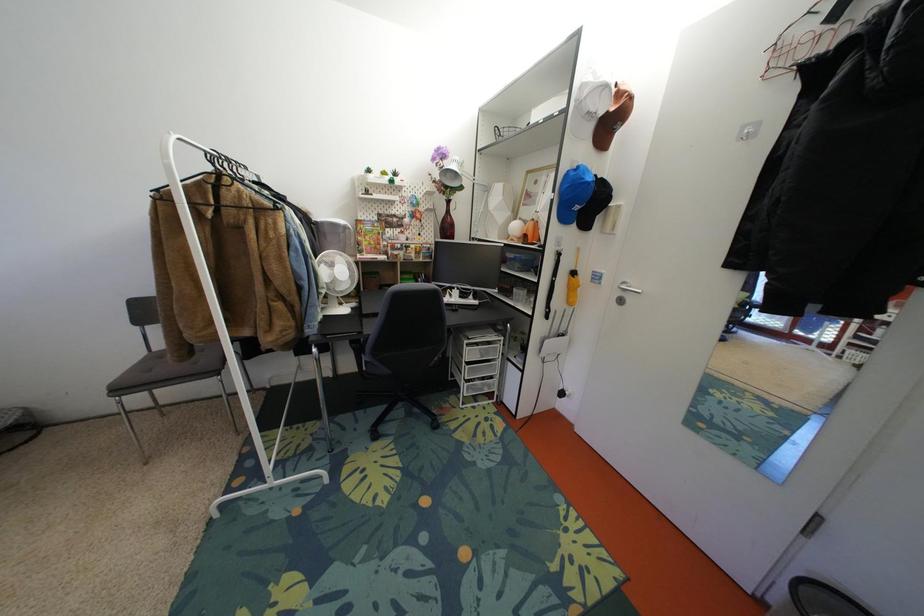
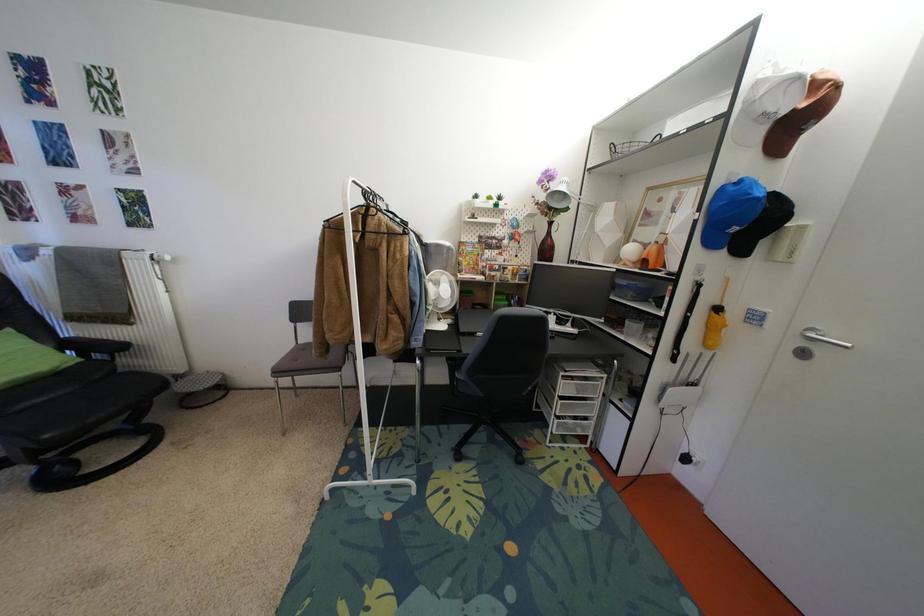
Question: Which direction would the cameraman need to move to produce the second image? Reply with the corresponding letter.

Choices:
 (A) Left
 (B) Right
 (C) Forward
 (D) Backward

Answer: (A)